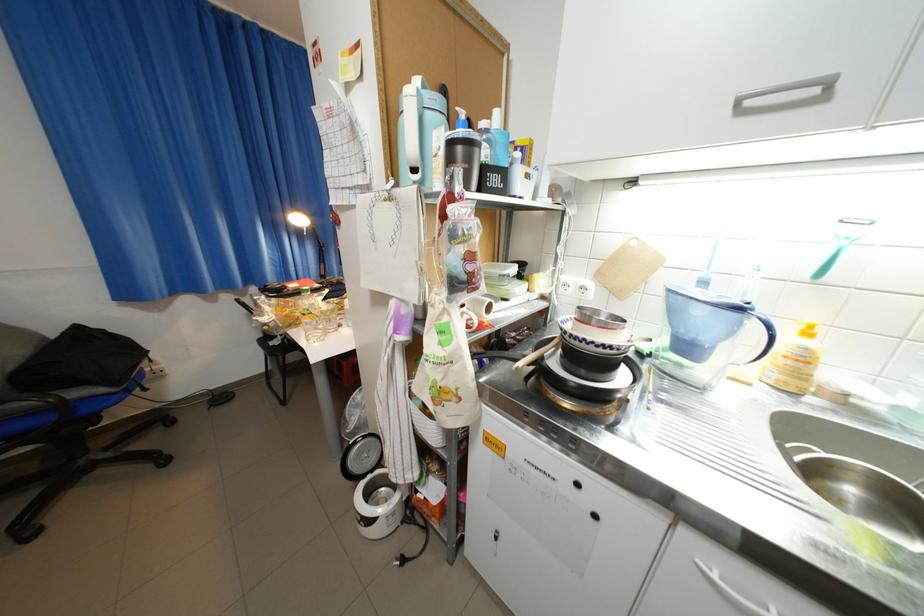
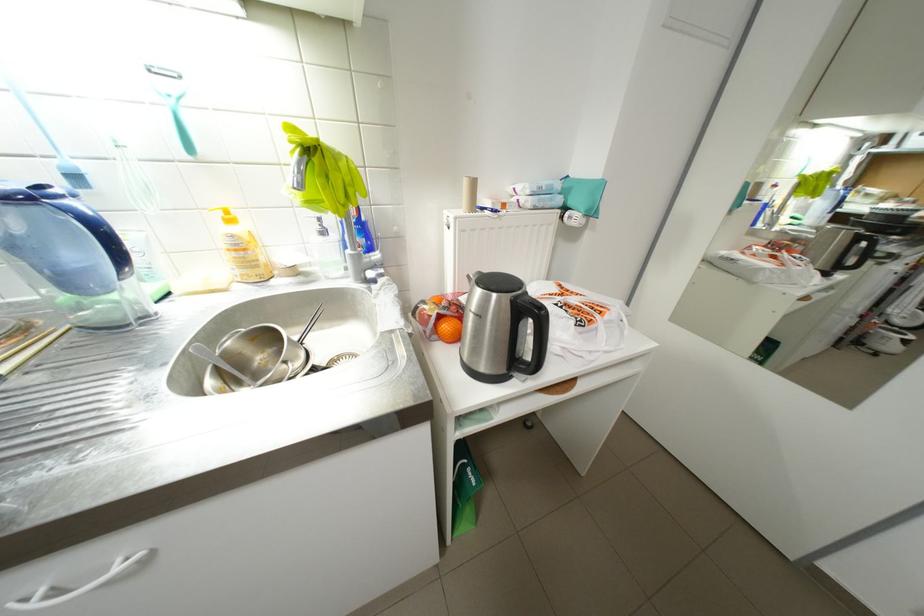
First-person continuous shooting, in which direction is the camera rotating?

The rotation direction of the camera is right-down.